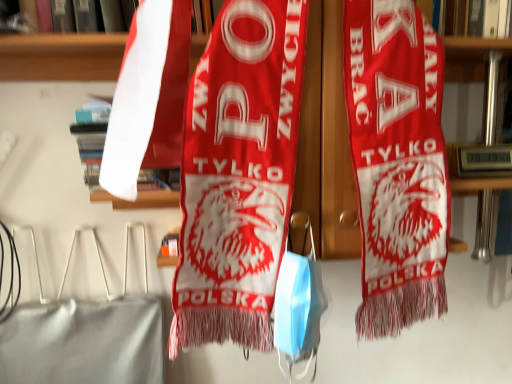
In order to face white paper at upper left, should I rotate leftwards or rightwards?

Turn left by 16.975 degrees to look at white paper at upper left.

This screenshot has width=512, height=384. Describe the element at coordinates (91, 137) in the screenshot. I see `white paper at upper left` at that location.

This screenshot has height=384, width=512. What are the coordinates of `white paper at upper left` in the screenshot? It's located at (91, 137).

Identify the location of white paper at upper left. The width and height of the screenshot is (512, 384). (91, 137).